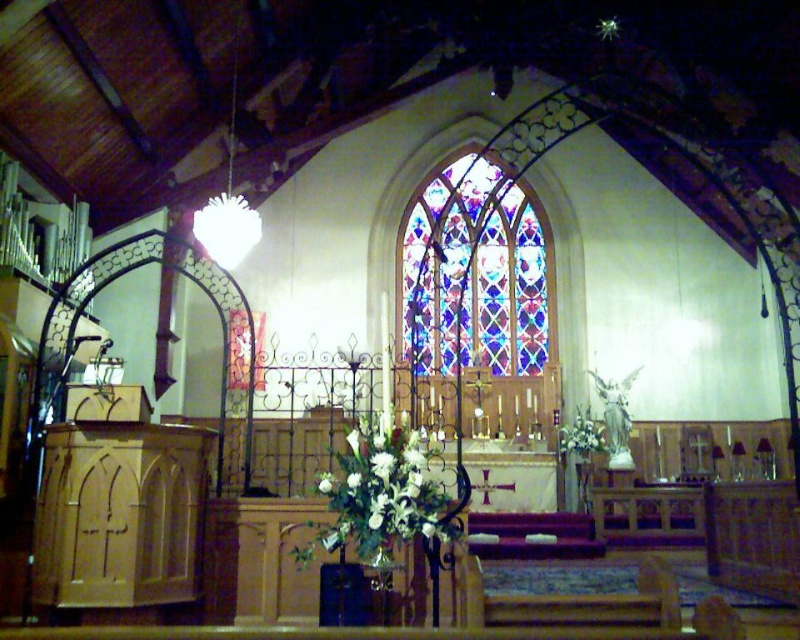
Is stained glass window at center in front of white floral bouquet at center?

No.

Locate an element on the screen. This screenshot has height=640, width=800. stained glass window at center is located at coordinates (474, 273).

The image size is (800, 640). I want to click on stained glass window at center, so click(x=474, y=273).